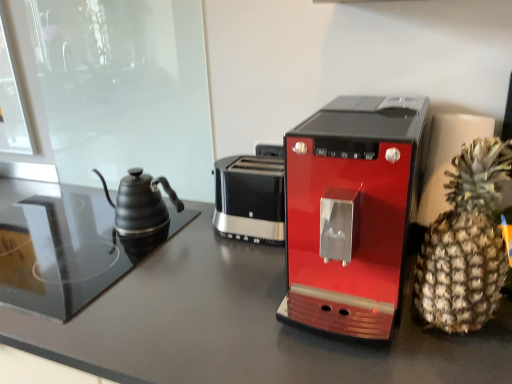
Image resolution: width=512 pixels, height=384 pixels. I want to click on vacant space situated on the left part of shiny red coffee maker at center, so click(x=199, y=286).